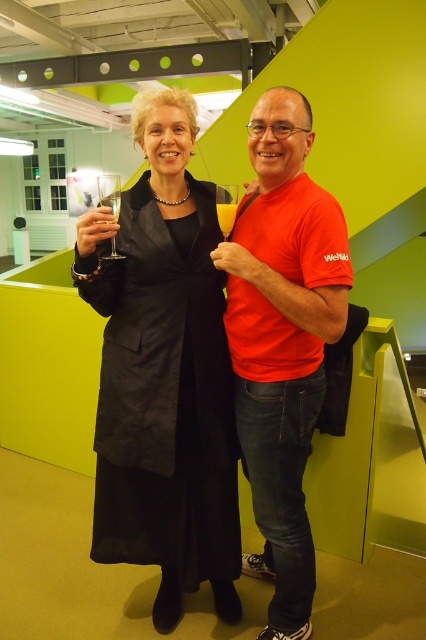
Question: Does clear glass at upper left appear under translucent glass at upper center?

Choices:
 (A) no
 (B) yes

Answer: (A)

Question: Which object is positioned closest to the translucent glass at upper center?

Choices:
 (A) black matte coat at center
 (B) matte red t-shirt at center
 (C) clear glass at upper left

Answer: (B)

Question: Among these points, which one is nearest to the camera?

Choices:
 (A) (221, 362)
 (B) (219, 186)

Answer: (B)

Question: Is matte red t-shirt at center further to camera compared to clear glass at upper left?

Choices:
 (A) no
 (B) yes

Answer: (A)

Question: Which of these objects is positioned closest to the matte red t-shirt at center?

Choices:
 (A) black matte coat at center
 (B) clear glass at upper left
 (C) translucent glass at upper center

Answer: (A)

Question: Is black matte coat at center wider than clear glass at upper left?

Choices:
 (A) no
 (B) yes

Answer: (A)